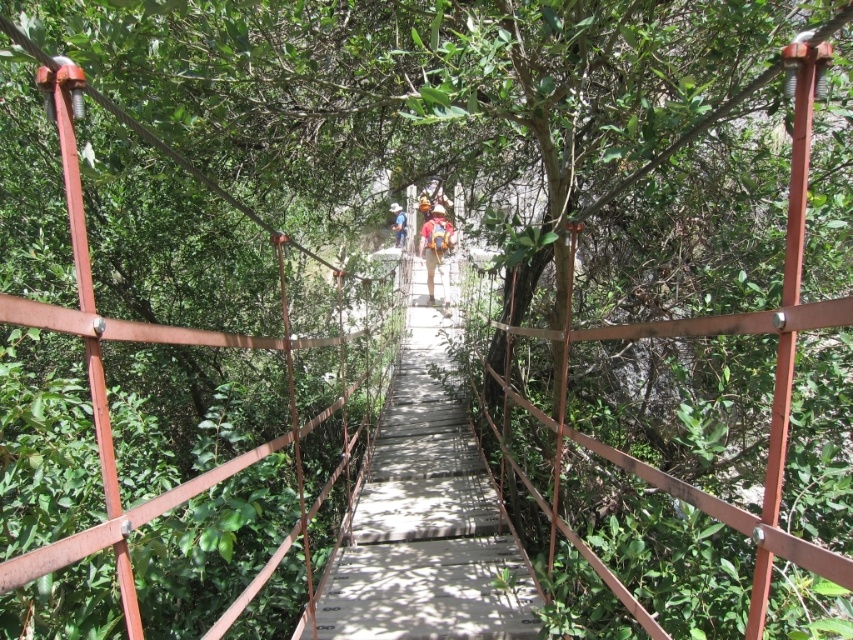
Looking at this image, you are standing on the wooden bridge at center and need to pass a light blue denim shirt at center to someone on the other side. Can you safely pass it without worrying about the bridge width?

The wooden bridge at center might be wider than light blue denim shirt at center, so it is likely safe to pass the shirt across the bridge without any issues related to width.

You are a hiker carrying a camouflage fabric backpack at center. You need to cross the wooden bridge at center. Can you safely walk across the bridge while carrying the backpack?

The wooden bridge at center is narrower than the camouflage fabric backpack at center, so it may not be safe to cross the bridge while carrying the backpack.